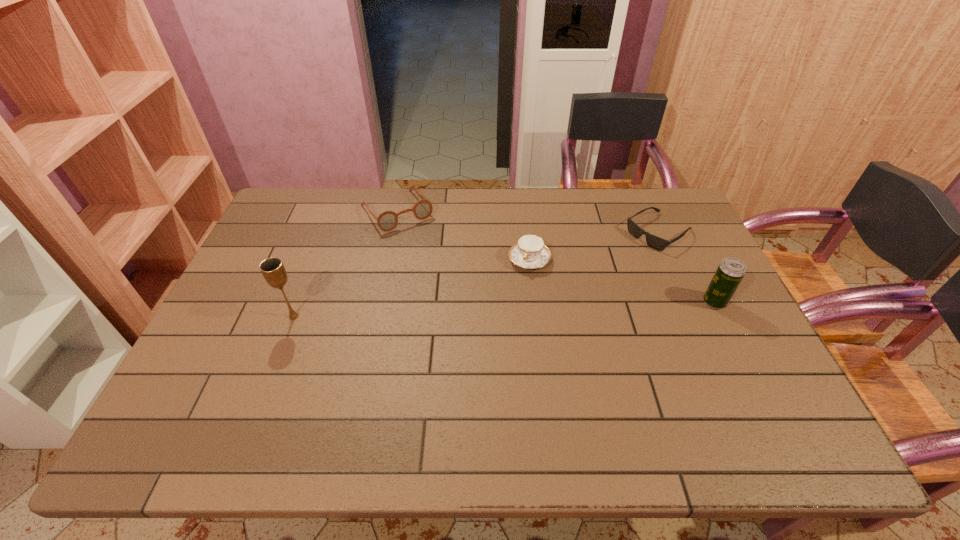
Locate an element on the screen. Image resolution: width=960 pixels, height=540 pixels. chalice is located at coordinates (273, 270).

Identify the location of the tallest object. This screenshot has width=960, height=540. (273, 270).

Identify the location of beer can. (730, 272).

You are a GUI agent. You are given a task and a screenshot of the screen. Output one action in this format:
    pyautogui.click(x=<x>, y=<y>)
    Task: Click on the teacup
    
    Given the screenshot: What is the action you would take?
    pyautogui.click(x=529, y=252)

I want to click on spectacles, so click(388, 220).

The image size is (960, 540). I want to click on the shortest object, so click(x=652, y=241).

This screenshot has width=960, height=540. I want to click on free space located 0.380m on the back of the chalice, so (330, 222).

Image resolution: width=960 pixels, height=540 pixels. I want to click on free space located on the left of the beer can, so click(635, 302).

Locate an element on the screen. This screenshot has width=960, height=540. vacant space located 0.150m on the side with the handle of the third object from right to left is located at coordinates (505, 309).

Image resolution: width=960 pixels, height=540 pixels. Identify the location of free point located on the side with the handle of the third object from right to left. (502, 314).